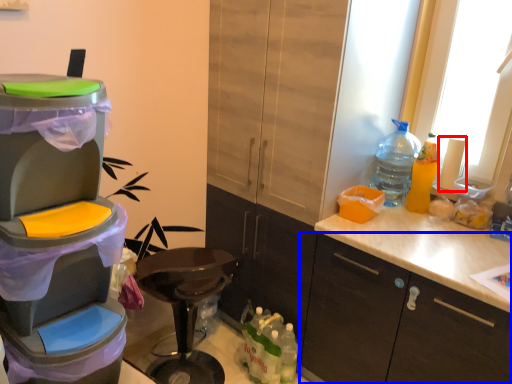
Question: Which of the following is the farthest to the observer, toilet paper (highlighted by a red box) or cabinetry (highlighted by a blue box)?

Choices:
 (A) toilet paper
 (B) cabinetry

Answer: (A)